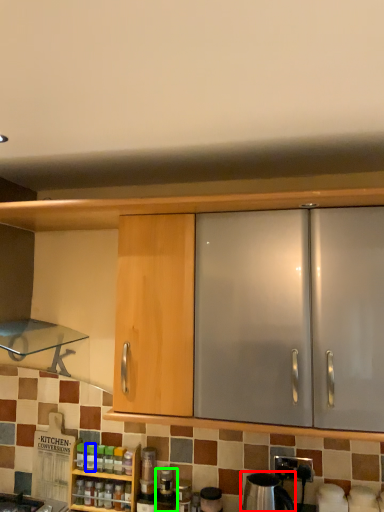
Question: Which object is the closest to the appliance (highlighted by a red box)? Choose among these: bottle (highlighted by a blue box) or bottle (highlighted by a green box).

Choices:
 (A) bottle
 (B) bottle

Answer: (B)